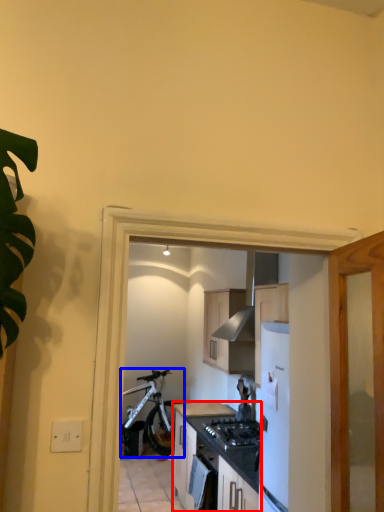
Question: Which object appears closest to the camera in this image, cabinetry (highlighted by a red box) or bicycle (highlighted by a blue box)?

Choices:
 (A) cabinetry
 (B) bicycle

Answer: (A)